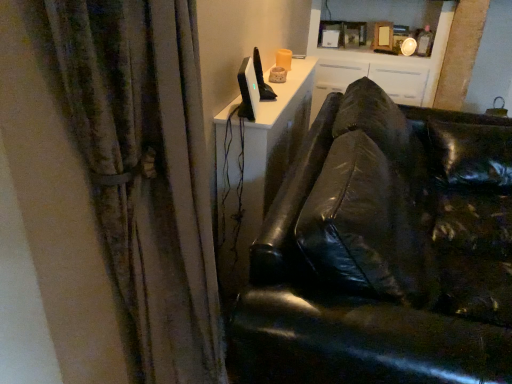
Question: From a real-world perspective, is black leather couch at right on top of satin black monitor at upper center?

Choices:
 (A) yes
 (B) no

Answer: (B)

Question: From a real-world perspective, is black leather couch at right under satin black monitor at upper center?

Choices:
 (A) no
 (B) yes

Answer: (B)

Question: Could you tell me if black leather couch at right is facing satin black monitor at upper center?

Choices:
 (A) yes
 (B) no

Answer: (B)

Question: Does black leather couch at right lie in front of satin black monitor at upper center?

Choices:
 (A) yes
 (B) no

Answer: (A)

Question: Considering the relative sizes of black leather couch at right and satin black monitor at upper center in the image provided, is black leather couch at right shorter than satin black monitor at upper center?

Choices:
 (A) yes
 (B) no

Answer: (B)

Question: From the image's perspective, does black leather couch at right appear lower than satin black monitor at upper center?

Choices:
 (A) yes
 (B) no

Answer: (A)

Question: From a real-world perspective, is textured fabric curtain at left below satin black monitor at upper center?

Choices:
 (A) no
 (B) yes

Answer: (B)

Question: Is textured fabric curtain at left completely or partially outside of satin black monitor at upper center?

Choices:
 (A) yes
 (B) no

Answer: (A)

Question: Is textured fabric curtain at left bigger than satin black monitor at upper center?

Choices:
 (A) yes
 (B) no

Answer: (A)

Question: Is textured fabric curtain at left shorter than satin black monitor at upper center?

Choices:
 (A) no
 (B) yes

Answer: (A)

Question: Considering the relative positions of textured fabric curtain at left and satin black monitor at upper center in the image provided, is textured fabric curtain at left in front of satin black monitor at upper center?

Choices:
 (A) yes
 (B) no

Answer: (A)

Question: From the image's perspective, is textured fabric curtain at left on satin black monitor at upper center?

Choices:
 (A) no
 (B) yes

Answer: (A)

Question: From the image's perspective, is white glossy cabinet at upper center below textured fabric curtain at left?

Choices:
 (A) no
 (B) yes

Answer: (A)